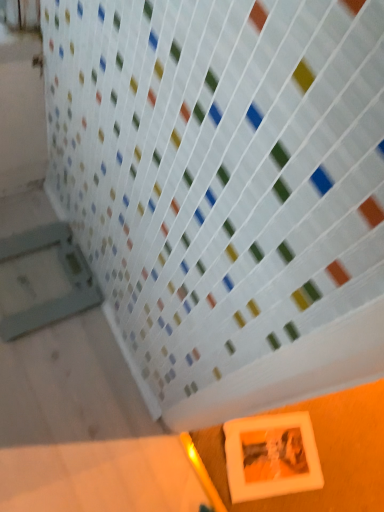
Find the location of a particular element. This screenshot has height=512, width=384. vacant space underneath white matte picture frame at lower right (from a real-world perspective) is located at coordinates 265,444.